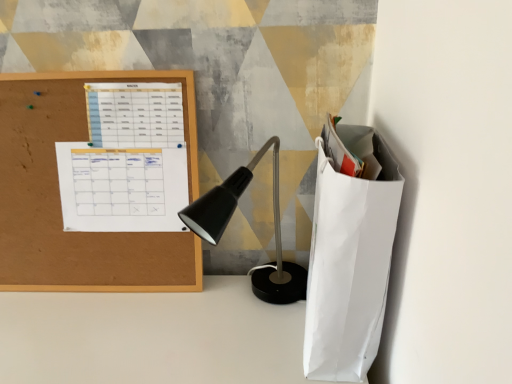
Question: Is white paper bag at right facing away from cork board at left?

Choices:
 (A) yes
 (B) no

Answer: (B)

Question: From a real-world perspective, is white paper bag at right located higher than cork board at left?

Choices:
 (A) no
 (B) yes

Answer: (A)

Question: Does white paper bag at right have a lesser height compared to cork board at left?

Choices:
 (A) no
 (B) yes

Answer: (B)

Question: Is white paper bag at right in front of cork board at left?

Choices:
 (A) no
 (B) yes

Answer: (B)

Question: Considering the relative positions of white paper bag at right and cork board at left in the image provided, is white paper bag at right behind cork board at left?

Choices:
 (A) no
 (B) yes

Answer: (A)

Question: Is white paper calendar at upper left, the second notebook viewed from the top, bigger or smaller than white paper bag at right?

Choices:
 (A) big
 (B) small

Answer: (B)

Question: From a real-world perspective, relative to white paper bag at right, is white paper calendar at upper left, the second notebook viewed from the top, vertically above or below?

Choices:
 (A) above
 (B) below

Answer: (A)

Question: Is white paper calendar at upper left, which appears as the 1th notebook when ordered from the bottom, in front of or behind white paper bag at right in the image?

Choices:
 (A) front
 (B) behind

Answer: (B)

Question: Considering the relative positions of white paper calendar at upper left, which appears as the 1th notebook when ordered from the bottom, and white paper bag at right in the image provided, is white paper calendar at upper left, which appears as the 1th notebook when ordered from the bottom, to the left or to the right of white paper bag at right?

Choices:
 (A) left
 (B) right

Answer: (A)

Question: Based on their sizes in the image, would you say cork board at left is bigger or smaller than white paper bag at right?

Choices:
 (A) big
 (B) small

Answer: (B)

Question: From a real-world perspective, is cork board at left positioned above or below white paper bag at right?

Choices:
 (A) above
 (B) below

Answer: (A)

Question: From the image's perspective, relative to white paper bag at right, is cork board at left above or below?

Choices:
 (A) above
 (B) below

Answer: (A)

Question: Do you think cork board at left is within white paper bag at right, or outside of it?

Choices:
 (A) outside
 (B) inside

Answer: (A)

Question: Is white paper calendar at upper left, the second notebook viewed from the top, taller or shorter than cork board at left?

Choices:
 (A) short
 (B) tall

Answer: (A)

Question: From the image's perspective, relative to cork board at left, is white paper calendar at upper left, the second notebook viewed from the top, above or below?

Choices:
 (A) below
 (B) above

Answer: (A)